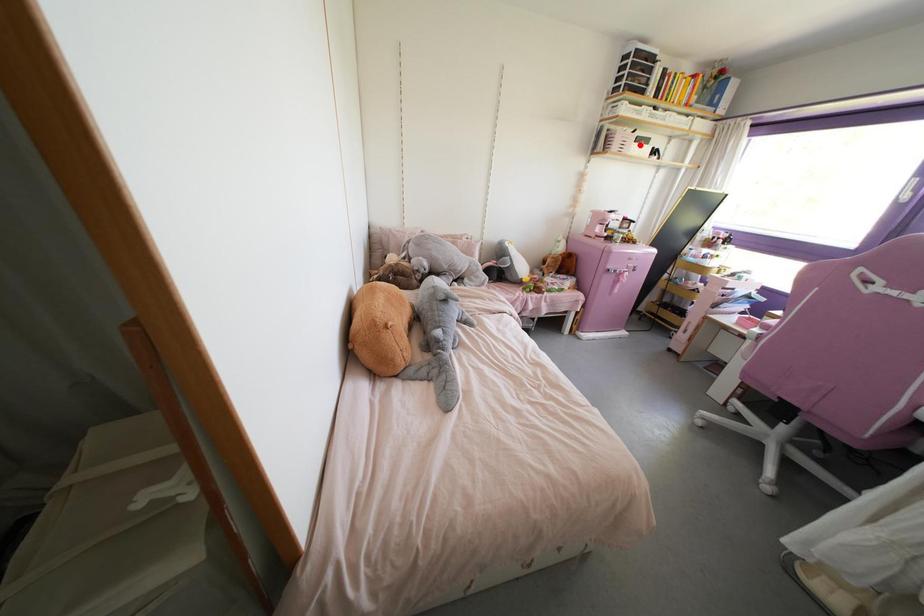
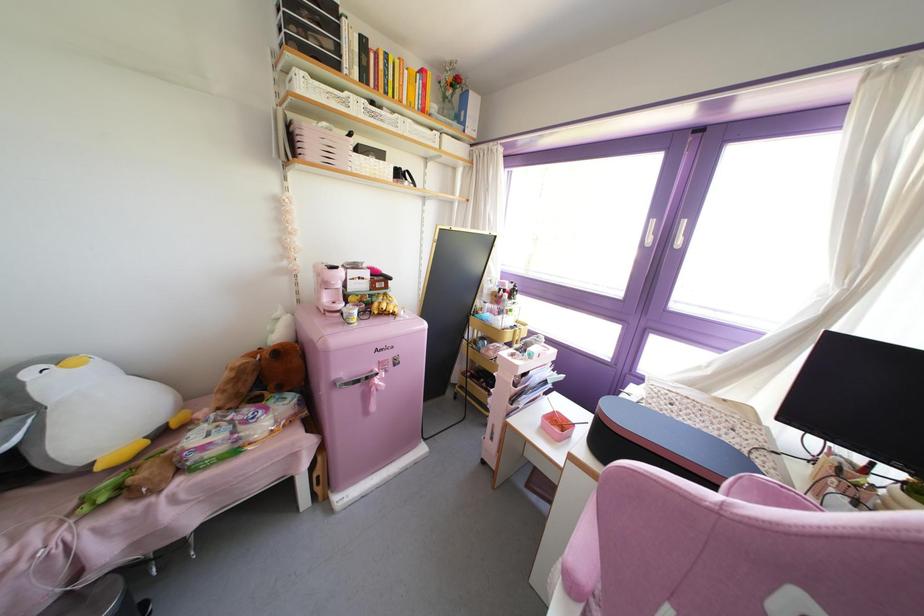
In the second image, find the point that corresponds to the highlighted location in the first image.

(371, 160)